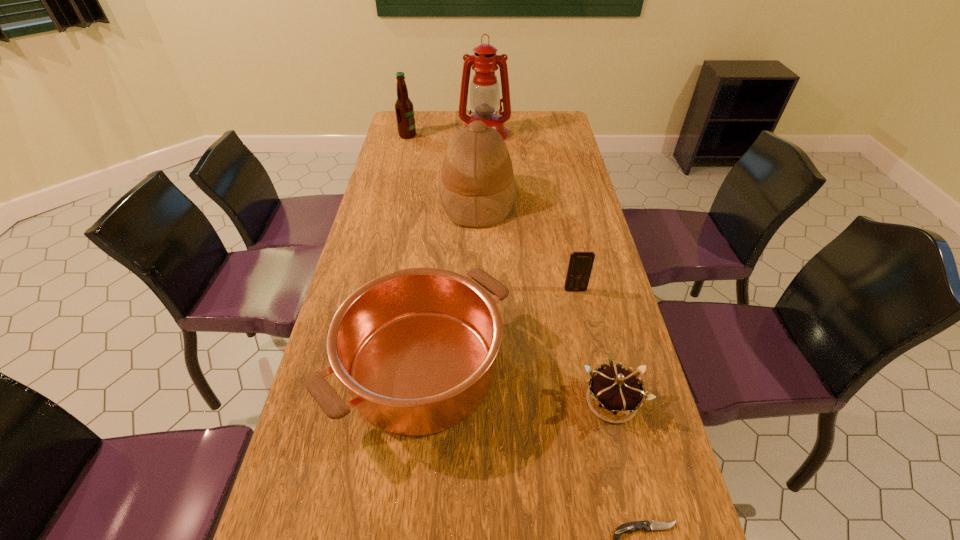
This screenshot has width=960, height=540. I want to click on the fifth closest object relative to the second shortest object, so click(485, 99).

This screenshot has height=540, width=960. What are the coordinates of `free location that satisfies the following two spatial constraints: 1. on the label of the beer bottle; 2. on the back side of the saucepan` in the screenshot? It's located at pyautogui.click(x=351, y=369).

Identify the location of free location that satisfies the following two spatial constraints: 1. on the back side of the crown; 2. on the label of the beer bottle. (550, 136).

What are the coordinates of `free space that satisfies the following two spatial constraints: 1. on the back side of the tallest object; 2. on the right side of the saucepan` in the screenshot? It's located at (447, 133).

You are a GUI agent. You are given a task and a screenshot of the screen. Output one action in this format:
    pyautogui.click(x=<x>, y=<y>)
    Task: Click on the vacant region that satisfies the following two spatial constraints: 1. on the screen of the crown; 2. on the left side of the fourth nearest object
    This screenshot has width=960, height=540.
    Given the screenshot: What is the action you would take?
    pyautogui.click(x=599, y=401)